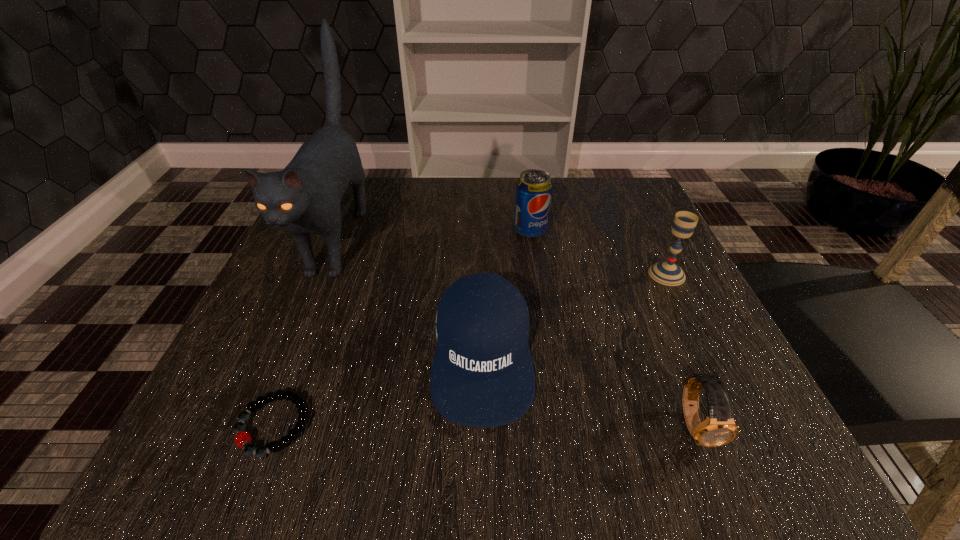
This screenshot has width=960, height=540. Find the location of `free space located 0.180m on the right of the shortest object`. free space located 0.180m on the right of the shortest object is located at coordinates (446, 426).

Identify the location of cat that is positioned at the far edge. (304, 198).

Image resolution: width=960 pixels, height=540 pixels. Find the location of `soda that is at the far edge`. soda that is at the far edge is located at coordinates (534, 189).

This screenshot has height=540, width=960. In order to click on baseball cap that is at the near edge in this screenshot , I will do `click(482, 375)`.

This screenshot has height=540, width=960. I want to click on watch that is at the near edge, so (719, 428).

You are a GUI agent. You are given a task and a screenshot of the screen. Output one action in this format:
    pyautogui.click(x=<x>, y=<y>)
    Task: Click on the bracelet situated at the near edge
    This screenshot has width=960, height=540.
    Given the screenshot: What is the action you would take?
    pyautogui.click(x=243, y=439)

The image size is (960, 540). I want to click on cat present at the left edge, so (304, 198).

This screenshot has height=540, width=960. I want to click on bracelet that is positioned at the left edge, so click(243, 439).

Locate an element on the screen. This screenshot has height=540, width=960. chalice present at the right edge is located at coordinates (668, 273).

The width and height of the screenshot is (960, 540). What are the coordinates of `watch at the right edge` in the screenshot? It's located at (719, 428).